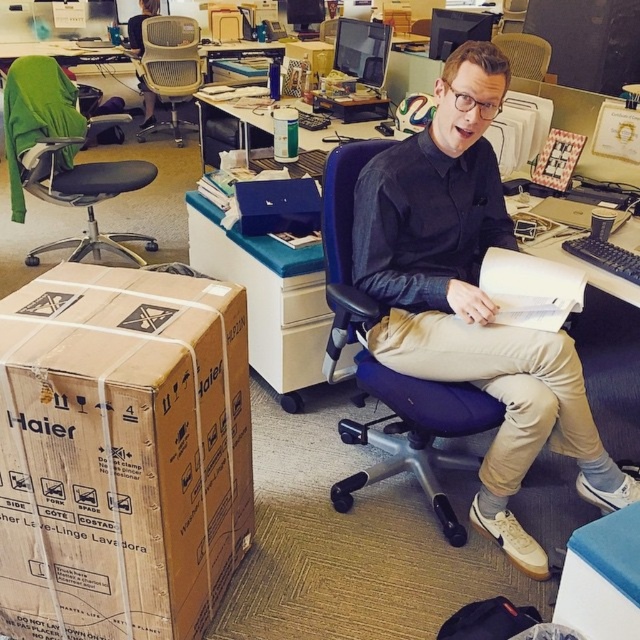
You are standing in the office scene and want to determine which point is nearer to you. The points are labeled as point 1 at coordinates (x=481, y=426) and point 2 at coordinates (x=19, y=182). Which point is closer to your current position?

Point 1 at coordinates (x=481, y=426) is closer to you than point 2 at coordinates (x=19, y=182).

You are organizing an office space and need to move the brown cardboard box at lower left and the green fabric swivel chair at upper left. Based on their current positions, which object is located to the right of the other?

The brown cardboard box at lower left is to the right of the green fabric swivel chair at upper left.

You are an office worker who needs to reach the metallic mesh chair at upper center. There is a matte black shirt at center in your way. Can you move the shirt to access the chair?

The matte black shirt at center is located below the metallic mesh chair at upper center, so you can access the chair without moving the shirt.